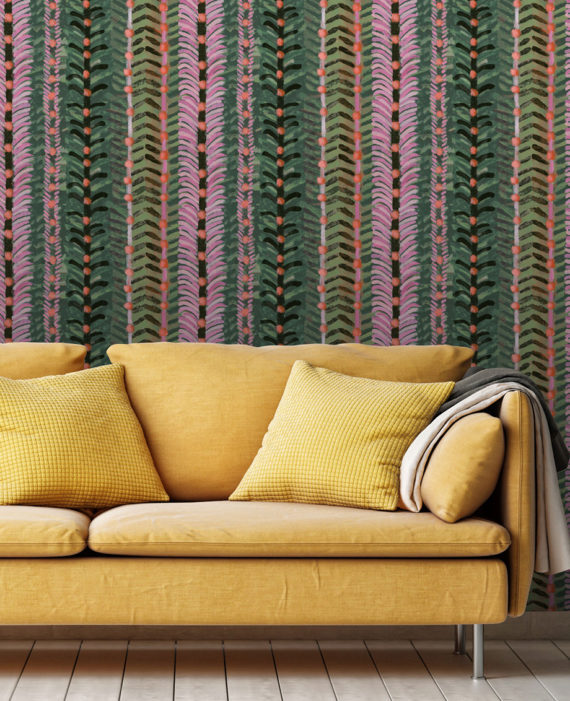
The height and width of the screenshot is (701, 570). Find the location of `pillows`. pillows is located at coordinates (472, 481), (360, 421), (3, 394).